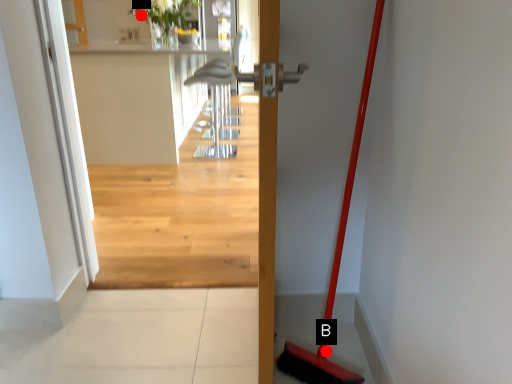
Question: Two points are circled on the image, labeled by A and B beside each circle. Which of the following is the closest to the observer?

Choices:
 (A) A is closer
 (B) B is closer

Answer: (B)